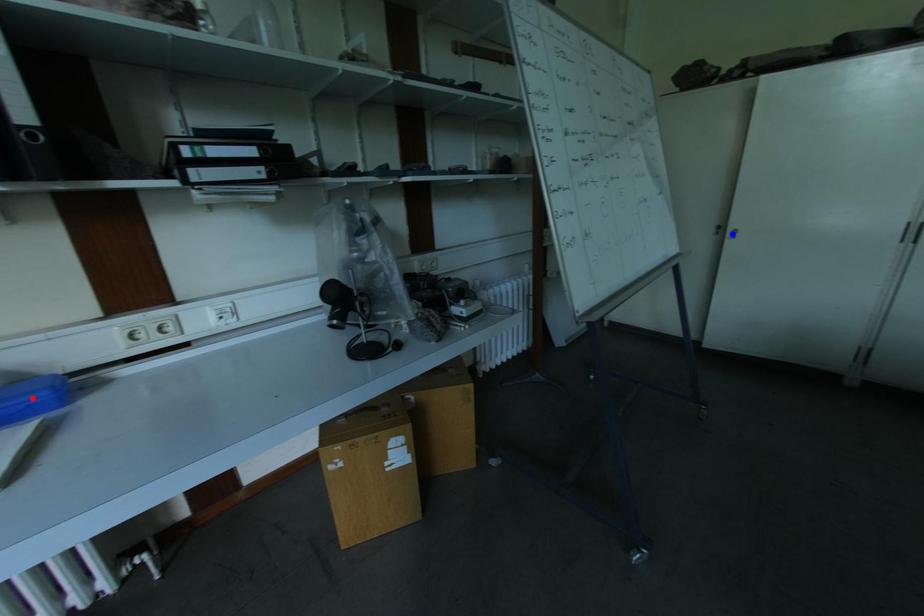
Question: In the image, two points are highlighted. Which point is nearer to the camera? Reply with the corresponding letter.

Choices:
 (A) blue point
 (B) red point

Answer: (B)